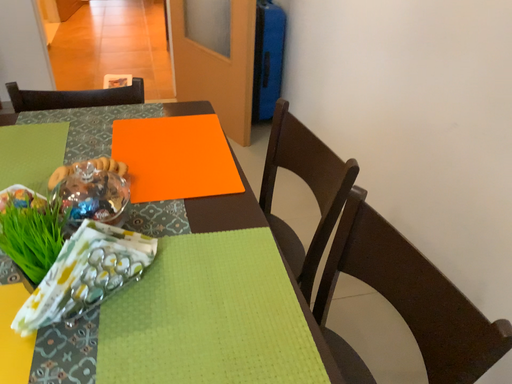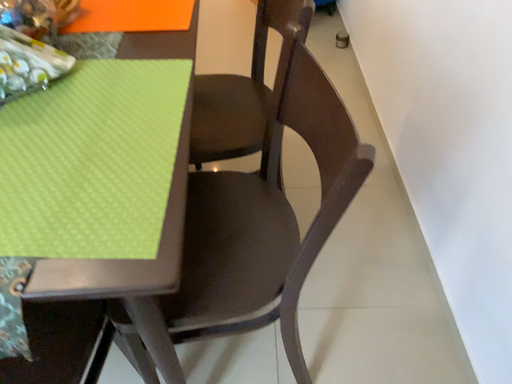
Question: How did the camera likely rotate when shooting the video?

Choices:
 (A) rotated left
 (B) rotated right

Answer: (A)